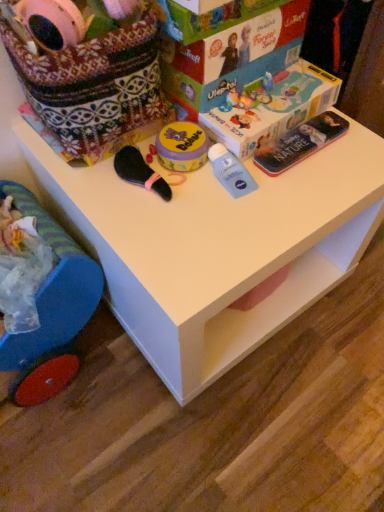
Where is `vacant area located to the right-hand side of matte plastic magazine at upper right`? The width and height of the screenshot is (384, 512). vacant area located to the right-hand side of matte plastic magazine at upper right is located at coordinates tap(355, 154).